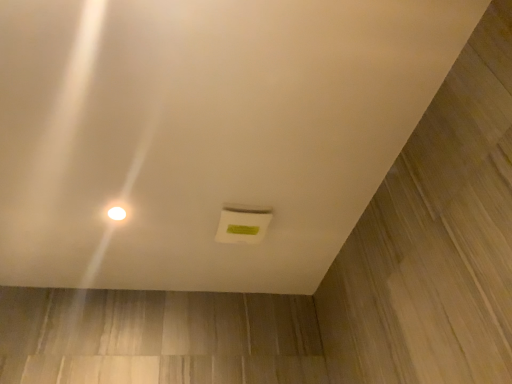
This screenshot has height=384, width=512. What are the coordinates of `vacant space behind white glossy light bulb at upper left` in the screenshot? It's located at (x=126, y=241).